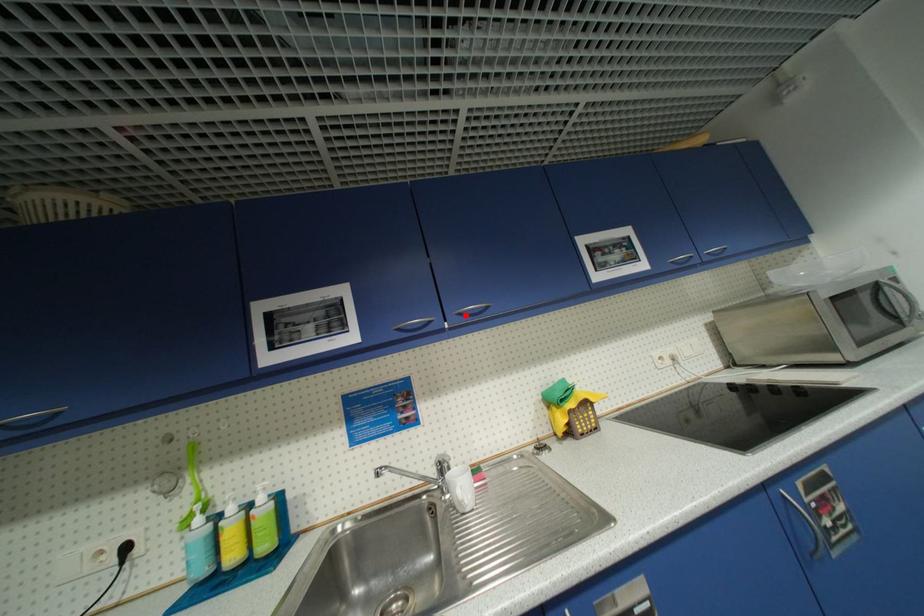
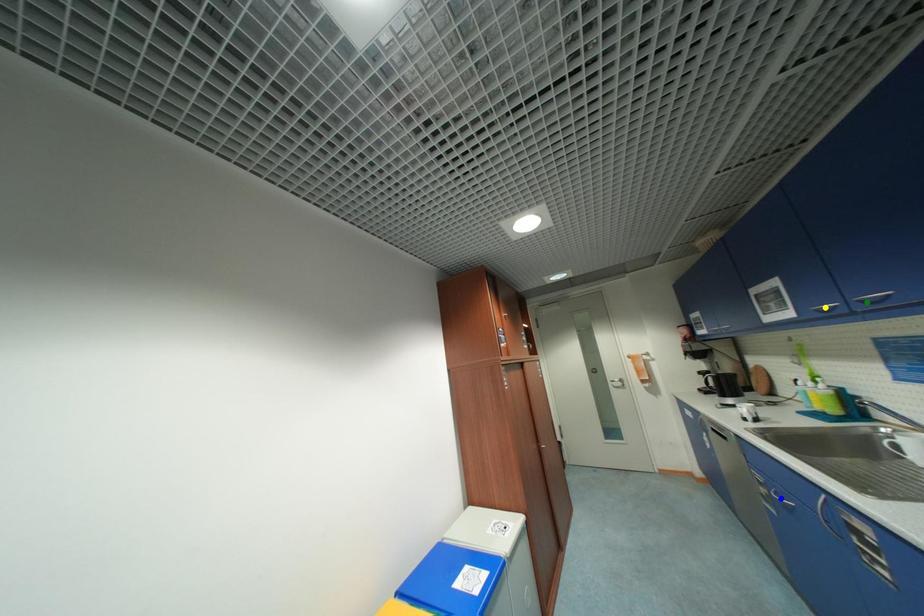
Question: I am providing you with two images of the same scene from different viewpoints. A red point is marked on the first image. You are given multiple points on the second image. Which point in image 2 represents the same 3d spot as the red point in image 1?

Choices:
 (A) yellow point
 (B) green point
 (C) blue point

Answer: (B)